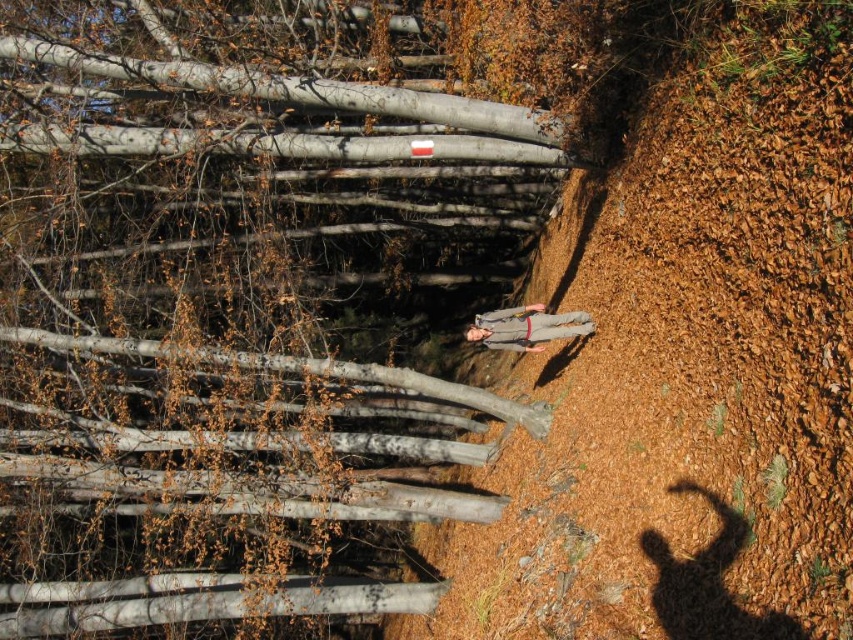
Question: Which point appears farthest from the camera in this image?

Choices:
 (A) (223, 464)
 (B) (560, 317)
 (C) (524, 444)

Answer: (C)

Question: Does smooth bark tree at center appear on the left side of brown dirt track at center?

Choices:
 (A) no
 (B) yes

Answer: (B)

Question: Estimate the real-world distances between objects in this image. Which object is farther from the brown dirt track at center?

Choices:
 (A) smooth bark tree at center
 (B) gray fabric jacket at center

Answer: (A)

Question: Can you confirm if brown dirt track at center is positioned above gray fabric jacket at center?

Choices:
 (A) no
 (B) yes

Answer: (B)

Question: Does smooth bark tree at center have a smaller size compared to brown dirt track at center?

Choices:
 (A) no
 (B) yes

Answer: (A)

Question: Which object is closer to the camera taking this photo?

Choices:
 (A) smooth bark tree at center
 (B) gray fabric jacket at center
 (C) brown dirt track at center

Answer: (C)